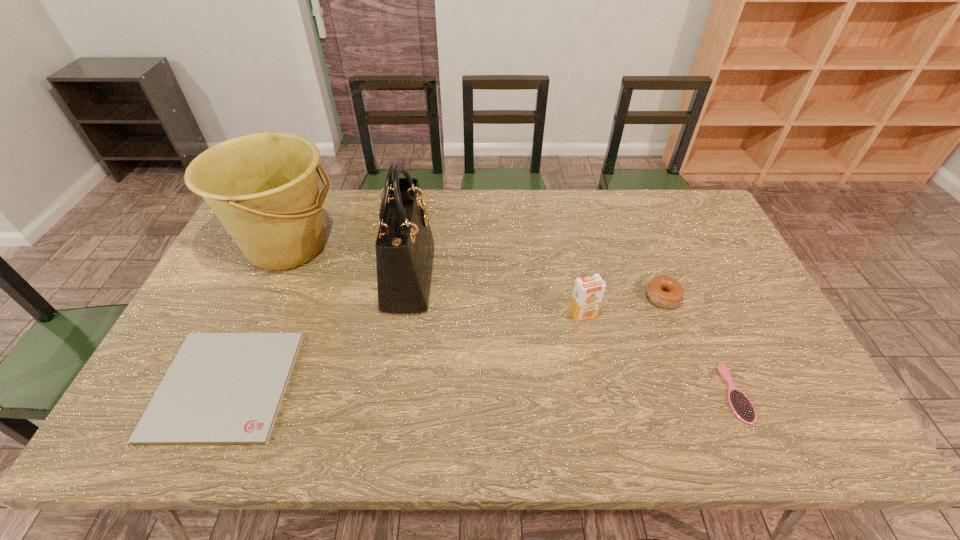
Find the location of `clipboard present at the left edge`. clipboard present at the left edge is located at coordinates (222, 388).

Image resolution: width=960 pixels, height=540 pixels. I want to click on object present at the right edge, so click(740, 404).

You are a GUI agent. You are given a task and a screenshot of the screen. Output one action in this format:
    pyautogui.click(x=<x>, y=<y>)
    Task: Click on the object positioned at the far left corner
    Image resolution: width=960 pixels, height=540 pixels.
    Given the screenshot: What is the action you would take?
    [x=263, y=187]

You are a GUI agent. You are given a task and a screenshot of the screen. Output one action in this format:
    pyautogui.click(x=<x>, y=<y>)
    Task: Click on the object present at the near left corner
    The image size is (960, 540).
    Given the screenshot: What is the action you would take?
    pyautogui.click(x=222, y=388)

Where is `object located in the near right corner section of the desktop`? The width and height of the screenshot is (960, 540). object located in the near right corner section of the desktop is located at coordinates (740, 404).

Find the location of a particular element. free location at the far edge of the desktop is located at coordinates (561, 213).

Identify the location of vacant space at the near edge of the desktop. (339, 446).

Locate an element on the screen. free region at the right edge of the desktop is located at coordinates (721, 284).

Where is `blank space at the far right corner of the desktop`? The height and width of the screenshot is (540, 960). blank space at the far right corner of the desktop is located at coordinates (693, 221).

You are a GUI agent. You are given a task and a screenshot of the screen. Output one action in this format:
    pyautogui.click(x=<x>, y=<y>)
    Task: Click on the blank region between the hairbrush and the bucket
    The height and width of the screenshot is (540, 960).
    Given the screenshot: What is the action you would take?
    pyautogui.click(x=512, y=319)